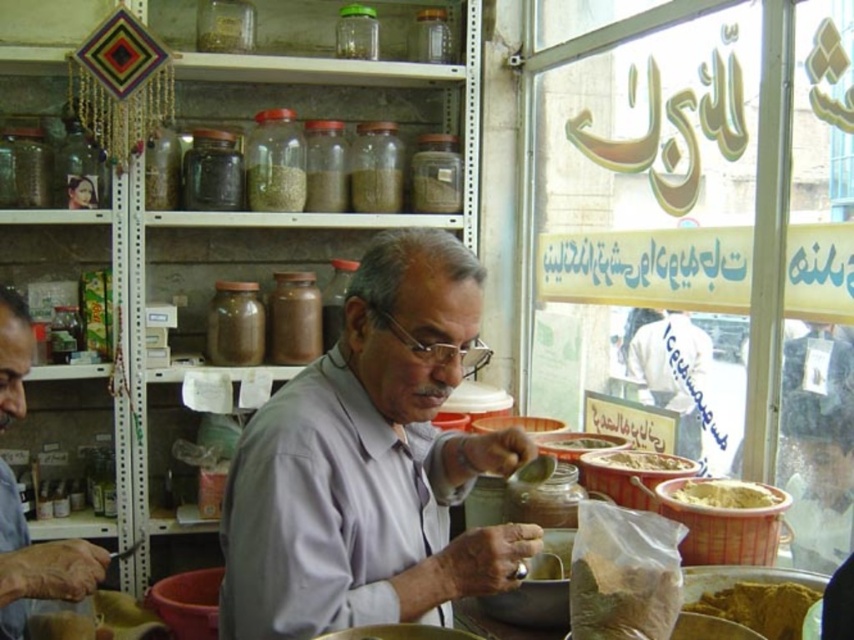
You are a customer in the spice shop. You notice the gray matte shirt at center and the transparent glass jar at upper center. Which object is taller?

The gray matte shirt at center is taller than the transparent glass jar at upper center according to the description.

You are a customer in the spice shop and want to locate the translucent glass jar at upper center. According to the coordinates provided, where exactly is it positioned?

The translucent glass jar at upper center is located at point [275,188].

You are a customer in the spice shop looking for a specific jar. You see the transparent glass jar at upper center marked by point (355, 33). Can you reach it without moving any other items?

The transparent glass jar at upper center marked by point (355, 33) is located at the upper center, so it might be reachable depending on your height and arm length, but since the jars are neatly arranged on perforated metal shelving units, you may need to move some jars to access it.